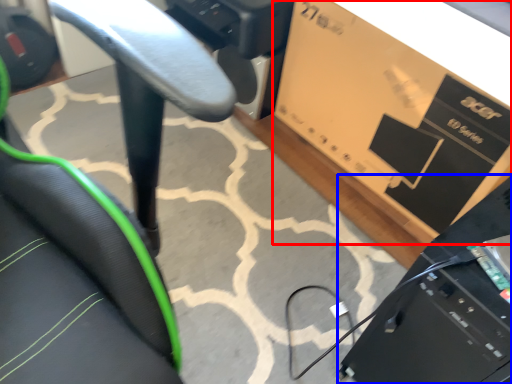
Question: Among these objects, which one is nearest to the camera, cardboard box (highlighted by a red box) or computer (highlighted by a blue box)?

Choices:
 (A) cardboard box
 (B) computer

Answer: (B)